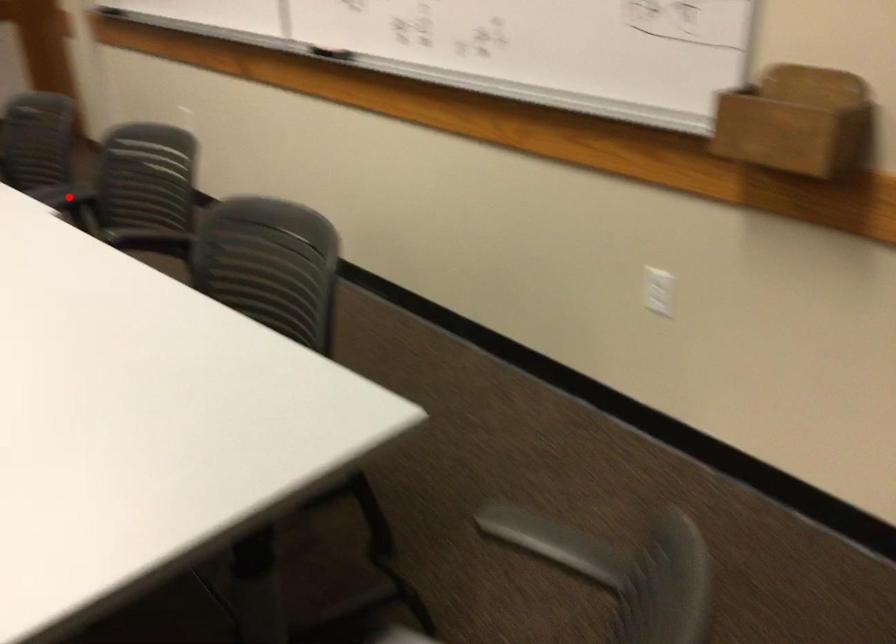
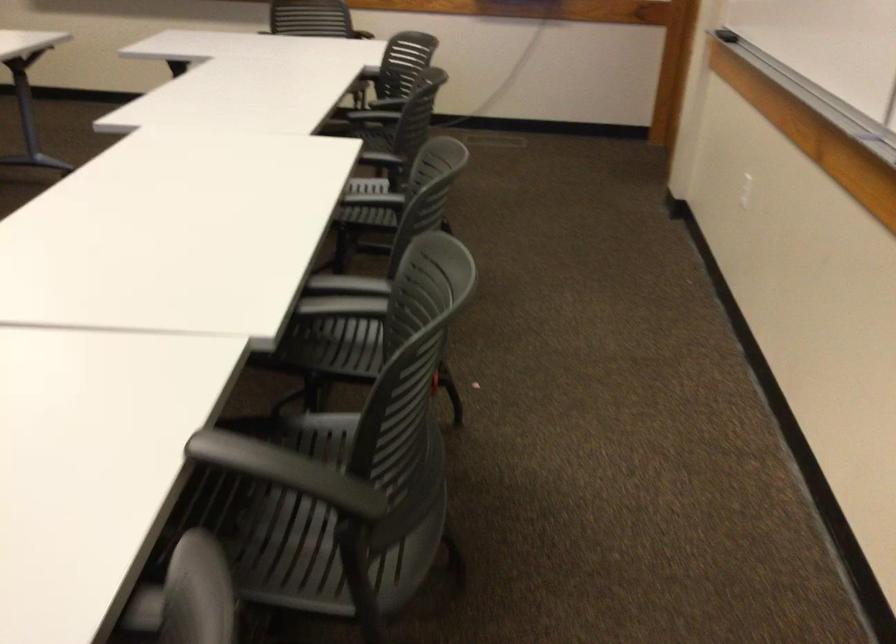
Question: I am providing you with two images of the same scene from different viewpoints. In image1, a red point is highlighted. Considering the same 3D point in image2, which of the following is correct?

Choices:
 (A) It is closer
 (B) It is farther

Answer: (A)